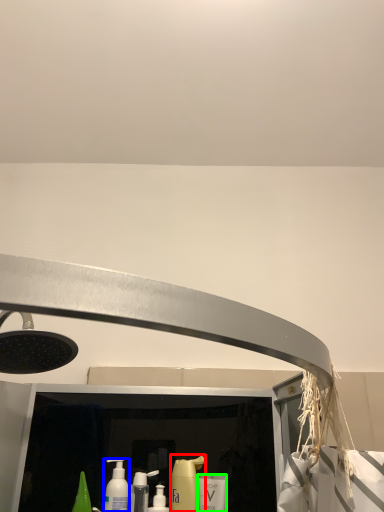
Question: Which object is positioned closest to cleaning product (highlighted by a red box)? Select from mouthwash (highlighted by a blue box) and mouthwash (highlighted by a green box).

Choices:
 (A) mouthwash
 (B) mouthwash

Answer: (B)